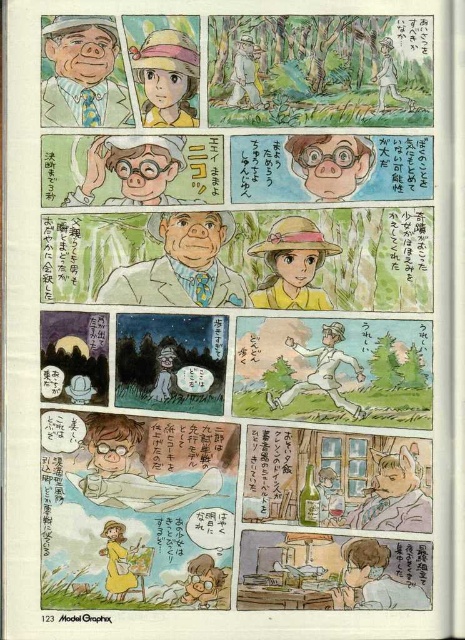
You are looking at a manga page with two points marked on it. The first point is at coordinate point (125, 266) and the second is at coordinate point (99, 19). Which point is closer to the camera?

Point (125, 266) is further to the camera than point (99, 19), so the second point is closer to the camera.

You are a character in the manga scene. You need to find the matte brown glasses at center and the matte pink glasses at upper right. Which one is located higher up in the image?

The matte pink glasses at upper right is located higher up in the image than the matte brown glasses at center.